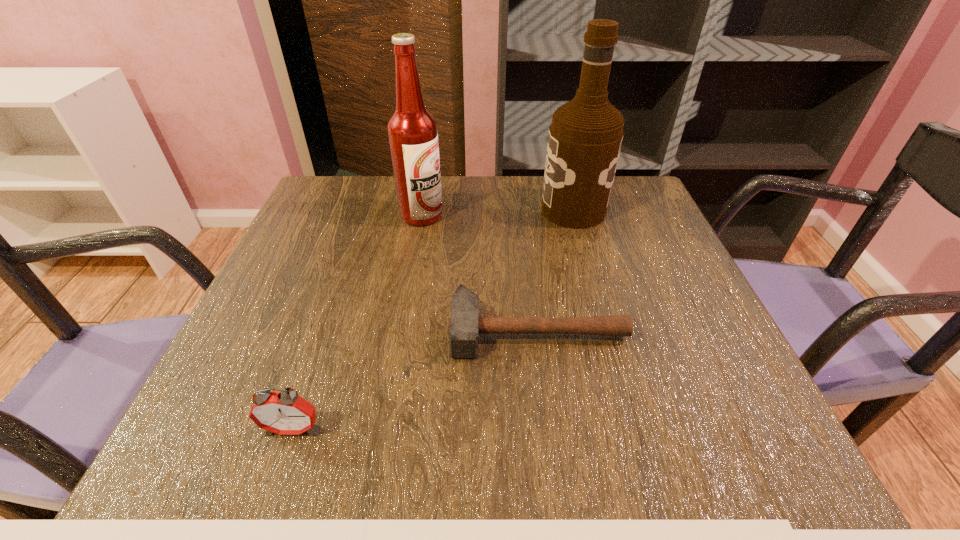
Identify the location of the right alcohol. (585, 137).

Find the location of `the third object from right to left`. the third object from right to left is located at coordinates 412,131.

The image size is (960, 540). I want to click on alarm clock, so click(x=285, y=413).

Identify the location of the nearest object. This screenshot has width=960, height=540. (285, 413).

Locate an element on the screen. the shortest object is located at coordinates (464, 325).

Find the location of `hammer`. hammer is located at coordinates (464, 325).

The width and height of the screenshot is (960, 540). I want to click on free space located 0.090m on the label of the right alcohol, so click(505, 210).

You are a GUI agent. You are given a task and a screenshot of the screen. Output one action in this format:
    pyautogui.click(x=<x>, y=<y>)
    Task: Click on the vacant region located 0.230m on the label of the right alcohol
    This screenshot has width=960, height=540.
    Given the screenshot: What is the action you would take?
    pyautogui.click(x=447, y=210)

The image size is (960, 540). I want to click on vacant space located on the label of the right alcohol, so click(x=509, y=210).

The height and width of the screenshot is (540, 960). What are the coordinates of `free space located 0.140m on the label side of the left alcohol` in the screenshot? It's located at (501, 215).